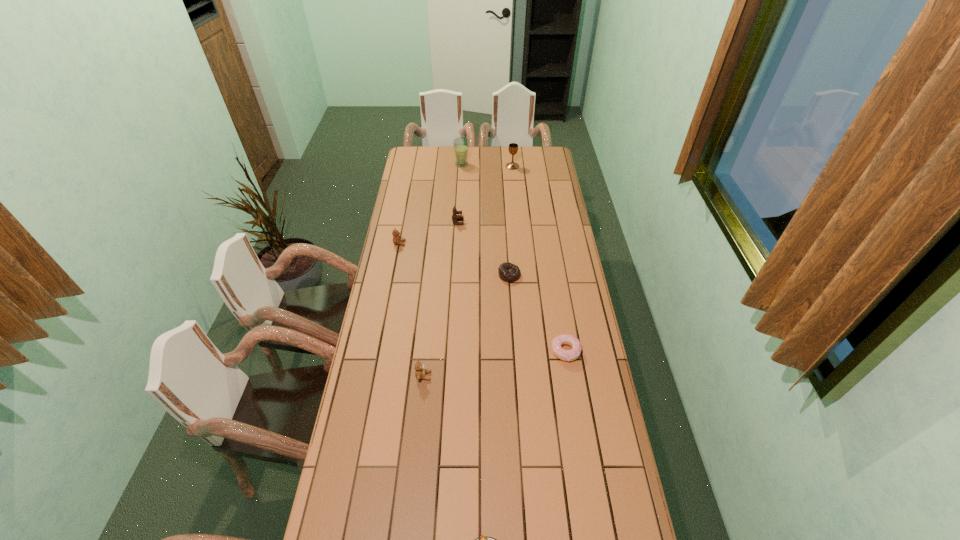
In order to click on vacant space that satisfies the following two spatial constraints: 1. on the front side of the glass; 2. on the face of the leftmost teddy bear in this screenshot , I will do `click(458, 243)`.

Where is `vacant position in the image that satisfies the following two spatial constraints: 1. on the back side of the beanbag; 2. on the face of the rightmost teddy bear`? This screenshot has width=960, height=540. vacant position in the image that satisfies the following two spatial constraints: 1. on the back side of the beanbag; 2. on the face of the rightmost teddy bear is located at coordinates (506, 222).